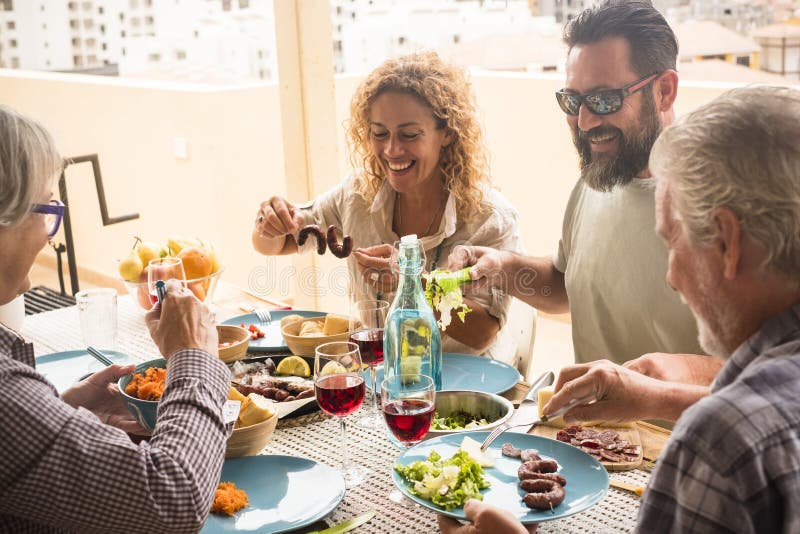
The height and width of the screenshot is (534, 800). In order to click on plates in this screenshot , I will do `click(276, 496)`, `click(274, 331)`, `click(502, 373)`, `click(501, 464)`.